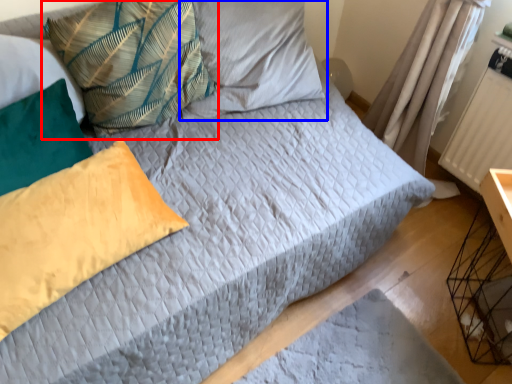
Question: Which of the following is the closest to the observer, pillow (highlighted by a red box) or pillow (highlighted by a blue box)?

Choices:
 (A) pillow
 (B) pillow

Answer: (A)